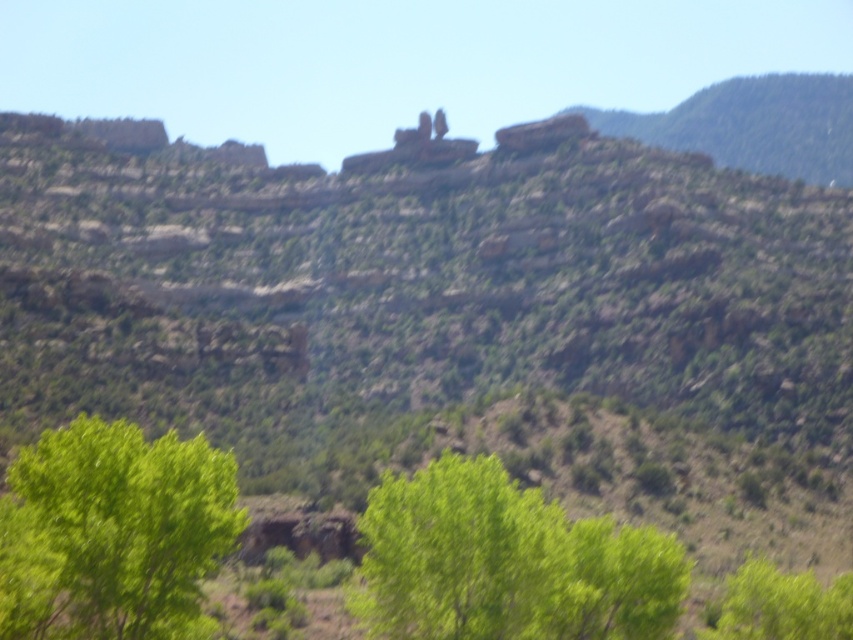
Question: Can you confirm if green leafy tree at lower left is positioned to the right of green leafy tree at lower right?

Choices:
 (A) yes
 (B) no

Answer: (B)

Question: Estimate the real-world distances between objects in this image. Which object is closer to the green leafy tree at lower right?

Choices:
 (A) reddish-brown rock at center
 (B) green leafy tree at lower left
 (C) green leafy tree at center

Answer: (C)

Question: Is green leafy tree at lower left bigger than green leafy tree at lower right?

Choices:
 (A) no
 (B) yes

Answer: (B)

Question: Does green leafy tree at lower right appear over reddish-brown rock at center?

Choices:
 (A) yes
 (B) no

Answer: (B)

Question: Which point appears closest to the camera in this image?

Choices:
 (A) (457, 573)
 (B) (538, 150)
 (C) (747, 570)

Answer: (A)

Question: Which point is farther to the camera?

Choices:
 (A) reddish-brown rock at center
 (B) green leafy tree at lower right

Answer: (A)